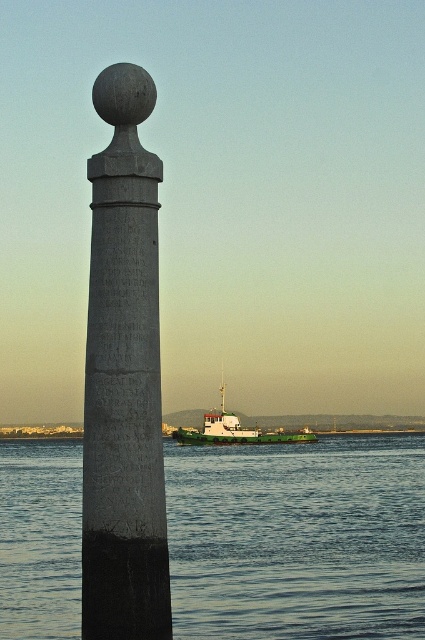
Between blue water at lower center and green matte boat at lower center, which one has more height?

Standing taller between the two is blue water at lower center.

Who is more distant from viewer, (303,456) or (277,429)?

Point (277,429)

Is point (71, 490) in front of point (289, 438)?

Yes, it is.

In order to click on blue water at lower center in this screenshot , I will do `click(297, 540)`.

Is gray stone column at left taller than green matte boat at lower center?

In fact, gray stone column at left may be shorter than green matte boat at lower center.

Looking at this image, can you confirm if gray stone column at left is positioned to the right of green matte boat at lower center?

In fact, gray stone column at left is to the left of green matte boat at lower center.

Image resolution: width=425 pixels, height=640 pixels. What are the coordinates of `gray stone column at left` in the screenshot? It's located at (124, 378).

Where is `blue water at lower center`? This screenshot has height=640, width=425. blue water at lower center is located at coordinates (297, 540).

Is point (353, 580) farther from viewer compared to point (129, 488)?

Yes, it is.

Is point (209, 452) more distant than point (136, 260)?

That is True.

Where is `blue water at lower center`? Image resolution: width=425 pixels, height=640 pixels. blue water at lower center is located at coordinates (297, 540).